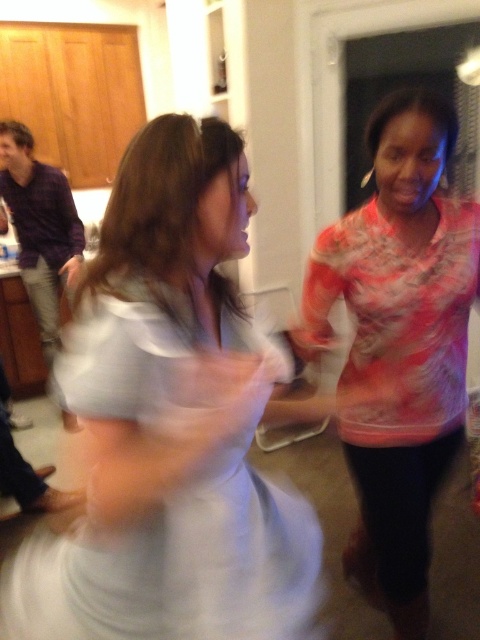
How distant is white satin dress at center from multicolored sheer blouse at right?

20.61 inches

Who is positioned more to the left, white satin dress at center or multicolored sheer blouse at right?

From the viewer's perspective, white satin dress at center appears more on the left side.

Measure the distance between point (164, 500) and camera.

Point (164, 500) is 29.84 inches from camera.

Where is `white satin dress at center`? white satin dress at center is located at coordinates (178, 564).